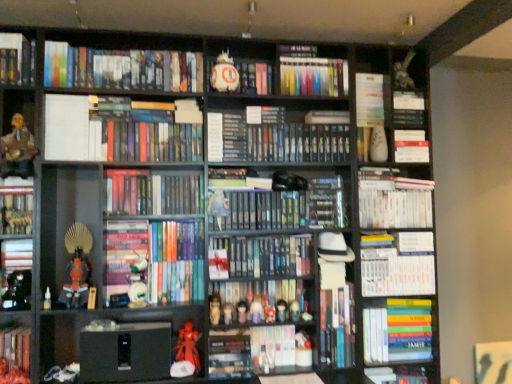
This screenshot has width=512, height=384. What do you see at coordinates (257, 311) in the screenshot?
I see `matte red figurine at center, which appears as the third toy when viewed from the right` at bounding box center [257, 311].

Measure the distance between point (423, 308) and camera.

The distance of point (423, 308) from camera is 2.36 meters.

The height and width of the screenshot is (384, 512). I want to click on hardcover book at center, the 3th book positioned from the bottom, so click(272, 347).

Is matte red figurine at center, placed as the 10th toy when sorted from left to right, to the left of hardcover books at center, which appears as the seventh book when viewed from the top, from the viewer's perspective?

In fact, matte red figurine at center, placed as the 10th toy when sorted from left to right, is to the right of hardcover books at center, which appears as the seventh book when viewed from the top.

Is matte red figurine at center, placed as the 10th toy when sorted from left to right, beside hardcover books at center, which is the 17th book in bottom-to-top order?

No, matte red figurine at center, placed as the 10th toy when sorted from left to right, is not in contact with hardcover books at center, which is the 17th book in bottom-to-top order.

Can you confirm if matte red figurine at center, placed as the 10th toy when sorted from left to right, is taller than hardcover books at center, which appears as the seventh book when viewed from the top?

In fact, matte red figurine at center, placed as the 10th toy when sorted from left to right, may be shorter than hardcover books at center, which appears as the seventh book when viewed from the top.

From the image's perspective, is matte red figurine at center, which appears as the third toy when viewed from the right, above or below hardcover books at center, which appears as the seventh book when viewed from the top?

matte red figurine at center, which appears as the third toy when viewed from the right, is below hardcover books at center, which appears as the seventh book when viewed from the top.

In the image, is matte red figurine at lower center, the 8th toy from the right, positioned in front of or behind white paper at upper left?

Visually, matte red figurine at lower center, the 8th toy from the right, is located behind white paper at upper left.

Who is smaller, matte red figurine at lower center, the 8th toy from the right, or white paper at upper left?

matte red figurine at lower center, the 8th toy from the right.

Considering the sizes of matte red figurine at lower center, the 5th toy from the left, and white paper at upper left in the image, is matte red figurine at lower center, the 5th toy from the left, wider or thinner than white paper at upper left?

Clearly, matte red figurine at lower center, the 5th toy from the left, has less width compared to white paper at upper left.

Is hardcover book at lower right, which ranks as the 1th book in bottom-to-top order, located within white paper book at upper right, which ranks as the eighteenth book in bottom-to-top order?

No, white paper book at upper right, which ranks as the eighteenth book in bottom-to-top order, does not contain hardcover book at lower right, which ranks as the 1th book in bottom-to-top order.

Is white paper book at upper right, placed as the sixth book when sorted from top to bottom, thinner than hardcover book at lower right, the 23th book in the top-to-bottom sequence?

Incorrect, the width of white paper book at upper right, placed as the sixth book when sorted from top to bottom, is not less than that of hardcover book at lower right, the 23th book in the top-to-bottom sequence.

In order to click on book that is the 2nd object located behind the white paper book at upper right, placed as the sixth book when sorted from top to bottom in this screenshot , I will do `click(397, 375)`.

How different are the orientations of white paper book at upper right, which ranks as the eighteenth book in bottom-to-top order, and hardcover book at lower right, which ranks as the 1th book in bottom-to-top order, in degrees?

1.1 degrees separate the facing orientations of white paper book at upper right, which ranks as the eighteenth book in bottom-to-top order, and hardcover book at lower right, which ranks as the 1th book in bottom-to-top order.

The height and width of the screenshot is (384, 512). What are the coordinates of `the 4th book below the white matte figurine at center, arranged as the fourth toy when viewed from the left (from the image's perspective)` in the screenshot? It's located at (398, 331).

How different are the orientations of white matte figurine at center, acting as the 9th toy starting from the right, and hardcover books at right, the 6th book ordered from the bottom, in degrees?

The angle between the facing direction of white matte figurine at center, acting as the 9th toy starting from the right, and the facing direction of hardcover books at right, the 6th book ordered from the bottom, is 4.02 degrees.

Which point is more distant from viewer, [131,295] or [428,307]?

Point [428,307]

Looking at this image, is white matte figurine at center, acting as the 9th toy starting from the right, turned away from hardcover books at right, the eighteenth book positioned from the top?

That's not correct — white matte figurine at center, acting as the 9th toy starting from the right, is not looking away from hardcover books at right, the eighteenth book positioned from the top.

From the image's perspective, between hardcover books at center, positioned as the 22th book in bottom-to-top order, and matte plastic figurines at center, placed as the 7th book when sorted from bottom to top, who is located below?

From the image's view, matte plastic figurines at center, placed as the 7th book when sorted from bottom to top, is below.

Is hardcover books at center, positioned as the 22th book in bottom-to-top order, oriented towards matte plastic figurines at center, the 17th book in the top-to-bottom sequence?

No, hardcover books at center, positioned as the 22th book in bottom-to-top order, is not aimed at matte plastic figurines at center, the 17th book in the top-to-bottom sequence.

Is hardcover books at center, which is counted as the second book, starting from the top, far from matte plastic figurines at center, the 17th book in the top-to-bottom sequence?

Indeed, hardcover books at center, which is counted as the second book, starting from the top, is not near matte plastic figurines at center, the 17th book in the top-to-bottom sequence.

Which is more to the right, hardcover books at center, positioned as the 22th book in bottom-to-top order, or matte plastic figurines at center, the 17th book in the top-to-bottom sequence?

From the viewer's perspective, hardcover books at center, positioned as the 22th book in bottom-to-top order, appears more on the right side.

Does matte plastic figurine at center, which is counted as the 7th toy, starting from the left, have a greater width compared to white matte figurine at upper right, the 12th toy viewed from the left?

Yes.

Is matte plastic figurine at center, the sixth toy positioned from the right, taller or shorter than white matte figurine at upper right, acting as the 1th toy starting from the right?

In the image, matte plastic figurine at center, the sixth toy positioned from the right, appears to be shorter than white matte figurine at upper right, acting as the 1th toy starting from the right.

Which is nearer, (212,214) or (382,125)?

The point (212,214) is closer to the camera.

Measure the distance between matte plastic figurine at center, the sixth toy positioned from the right, and white matte figurine at upper right, acting as the 1th toy starting from the right.

matte plastic figurine at center, the sixth toy positioned from the right, is 35.29 inches from white matte figurine at upper right, acting as the 1th toy starting from the right.

Is hardcover books at right, the eighteenth book positioned from the top, thinner than hardcover book at center, positioned as the eleventh book in bottom-to-top order?

No.

The width and height of the screenshot is (512, 384). There is a hardcover book at center, which is the thirteenth book in top-to-bottom order. In order to click on the 5th book below it (from a real-world perspective) in this screenshot , I will do pos(398,331).

Looking at this image, what's the angular difference between hardcover books at right, the eighteenth book positioned from the top, and hardcover book at center, positioned as the eleventh book in bottom-to-top order,'s facing directions?

4.46 degrees separate the facing orientations of hardcover books at right, the eighteenth book positioned from the top, and hardcover book at center, positioned as the eleventh book in bottom-to-top order.

Where is `the 3rd toy behind the hardcover books at center, which is the 17th book in bottom-to-top order, starting your count from the anchor`? The height and width of the screenshot is (384, 512). the 3rd toy behind the hardcover books at center, which is the 17th book in bottom-to-top order, starting your count from the anchor is located at coordinates (257, 311).

Find the location of `paperback book that is above the matte red figurine at lower center, the 5th toy from the left (from a real-world perspective)`. paperback book that is above the matte red figurine at lower center, the 5th toy from the left (from a real-world perspective) is located at coordinates (66, 127).

When comparing their distances from black hardcover books at center, the nineteenth book when ordered from bottom to top, does matte red figurine at center, placed as the 10th toy when sorted from left to right, or hardcover book at center, the twelfth book ordered from the bottom, seem further?

matte red figurine at center, placed as the 10th toy when sorted from left to right, is further to black hardcover books at center, the nineteenth book when ordered from bottom to top.

Based on their spatial positions, is hardcover book at center, which ranks as the 16th book in top-to-bottom order, or orange fabric figurine at lower left, acting as the tenth toy starting from the right, closer to hardcover books at center, which is the 17th book in bottom-to-top order?

The object closer to hardcover books at center, which is the 17th book in bottom-to-top order, is hardcover book at center, which ranks as the 16th book in top-to-bottom order.

Estimate the real-world distances between objects in this image. Which object is closer to hardcover books at center, which is counted as the second book, starting from the top, hardcover books at right, the eighteenth book positioned from the top, or matte plastic figurine at center, acting as the ninth toy starting from the left?

matte plastic figurine at center, acting as the ninth toy starting from the left.

Considering their positions, is matte plastic figurine at center, the sixth toy positioned from the right, positioned closer to white paper book at upper right, which ranks as the eighteenth book in bottom-to-top order, than hardcover book at center, which is the thirteenth book in top-to-bottom order?

Among the two, matte plastic figurine at center, the sixth toy positioned from the right, is located nearer to white paper book at upper right, which ranks as the eighteenth book in bottom-to-top order.

When comparing their distances from matte red figurine at center, which appears as the 8th toy when viewed from the left, does hardcover book at left, which is the 13th book in bottom-to-top order, or matte plastic figurines at center, placed as the 7th book when sorted from bottom to top, seem further?

hardcover book at left, which is the 13th book in bottom-to-top order, lies further to matte red figurine at center, which appears as the 8th toy when viewed from the left, than the other object.

Looking at the image, which one is located closer to hardcover book at center, placed as the sixteenth book when sorted from bottom to top, hardcover book at center, the fifth book ordered from the bottom, or matte brown leather jacket at left?

Based on the image, hardcover book at center, the fifth book ordered from the bottom, appears to be nearer to hardcover book at center, placed as the sixteenth book when sorted from bottom to top.

Considering their positions, is matte plastic figurine at center, positioned as the fourth toy in right-to-left order, positioned closer to hardcover book at lower right, which ranks as the 1th book in bottom-to-top order, than hardcover book at center, arranged as the eighth book when ordered from the bottom?

Among the two, matte plastic figurine at center, positioned as the fourth toy in right-to-left order, is located nearer to hardcover book at lower right, which ranks as the 1th book in bottom-to-top order.

Which object lies nearer to the anchor point matte plastic figurines at center, placed as the 7th book when sorted from bottom to top, matte black book at center, which ranks as the 14th book in bottom-to-top order, or hardcover books at upper left, which appears as the 21th book when ordered from the bottom?

matte black book at center, which ranks as the 14th book in bottom-to-top order, lies closer to matte plastic figurines at center, placed as the 7th book when sorted from bottom to top, than the other object.

Locate an element on the screen. The image size is (512, 384). person located between hardcover book at lower left, the second book in the bottom-to-top sequence, and matte red figurine at center, which appears as the third toy when viewed from the right, in the left-right direction is located at coordinates (18, 150).

This screenshot has width=512, height=384. I want to click on paperback book situated between shiny black figurine at left, positioned as the first toy in left-to-right order, and hardcover book at center, the 8th book when ordered from top to bottom, from left to right, so click(x=66, y=127).

The width and height of the screenshot is (512, 384). I want to click on person situated between shiny black figurine at left, placed as the 12th toy when sorted from right to left, and hardcover book at center, arranged as the eighth book when ordered from the bottom, from left to right, so click(x=18, y=150).

Identify the location of person between matte black book at left, the 14th book positioned from the top, and hardcover books at right, the 6th book ordered from the bottom, from left to right. (18, 150).